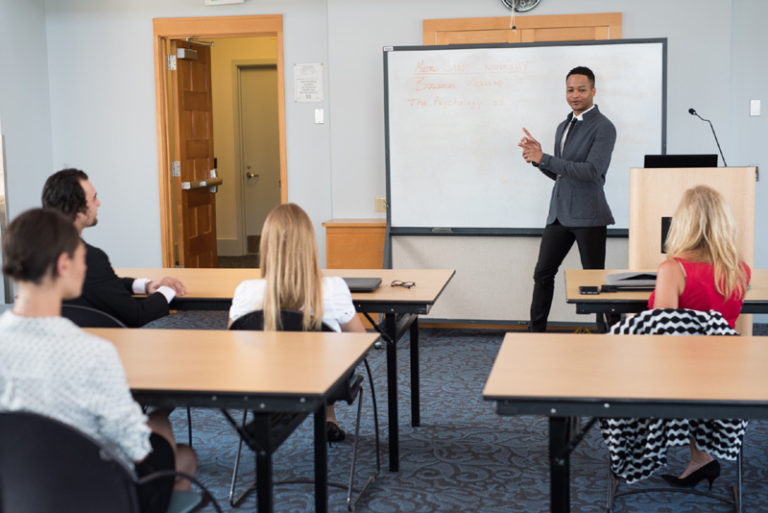
Where is `backs of chairs`? The height and width of the screenshot is (513, 768). backs of chairs is located at coordinates (58, 478), (93, 323), (290, 327), (687, 324).